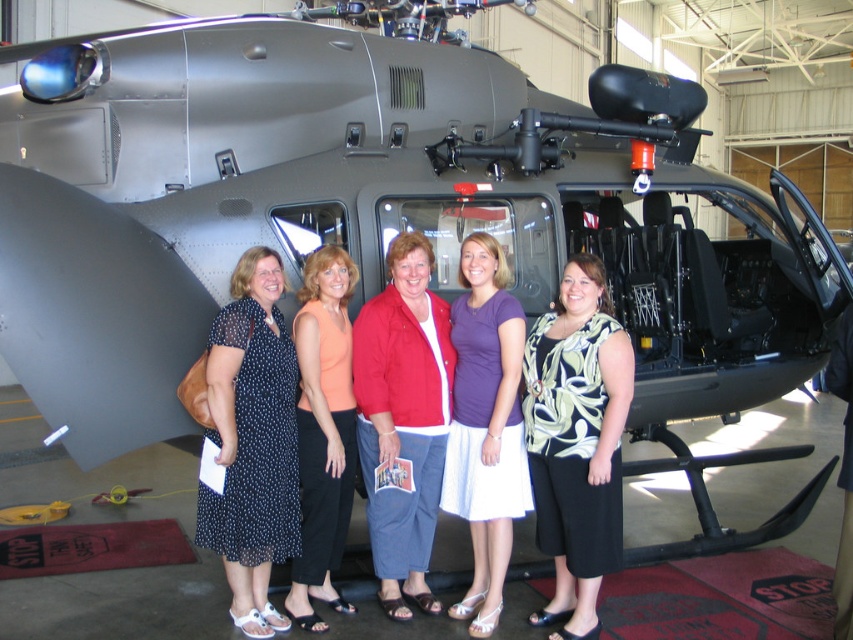
Question: Which point appears closest to the camera in this image?

Choices:
 (A) (514, 362)
 (B) (325, 356)
 (C) (576, 579)

Answer: (A)

Question: Among these points, which one is nearest to the camera?

Choices:
 (A) (312, 284)
 (B) (218, 513)

Answer: (B)

Question: Is floral print blouse at center closer to camera compared to purple cotton shirt at center?

Choices:
 (A) yes
 (B) no

Answer: (A)

Question: From the image, what is the correct spatial relationship of floral print blouse at center in relation to orange fabric top at center?

Choices:
 (A) right
 (B) left

Answer: (A)

Question: Estimate the real-world distances between objects in this image. Which object is farther from the orange fabric top at center?

Choices:
 (A) polka dot dress at center
 (B) purple cotton shirt at center

Answer: (B)

Question: Can you confirm if floral print blouse at center is positioned to the right of polka dot dress at center?

Choices:
 (A) yes
 (B) no

Answer: (A)